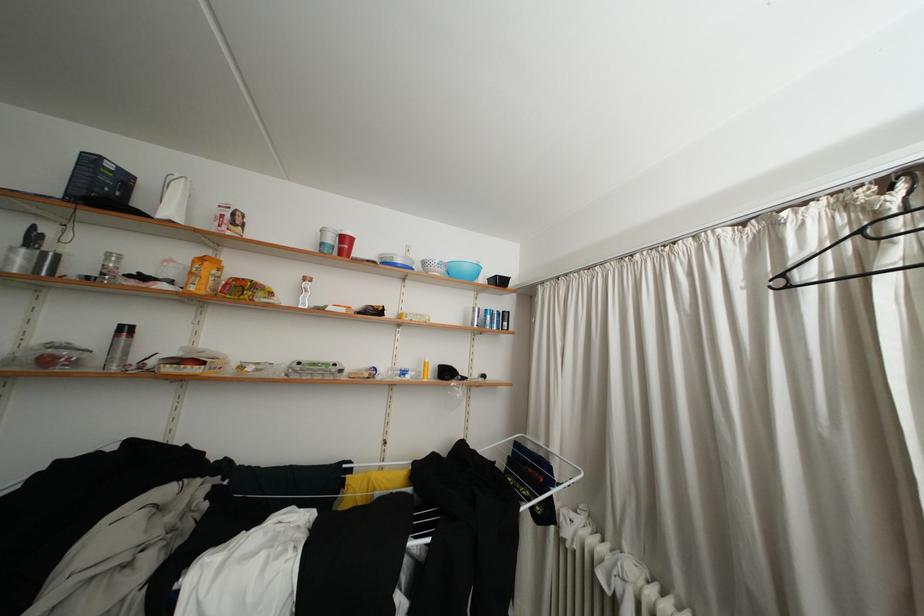
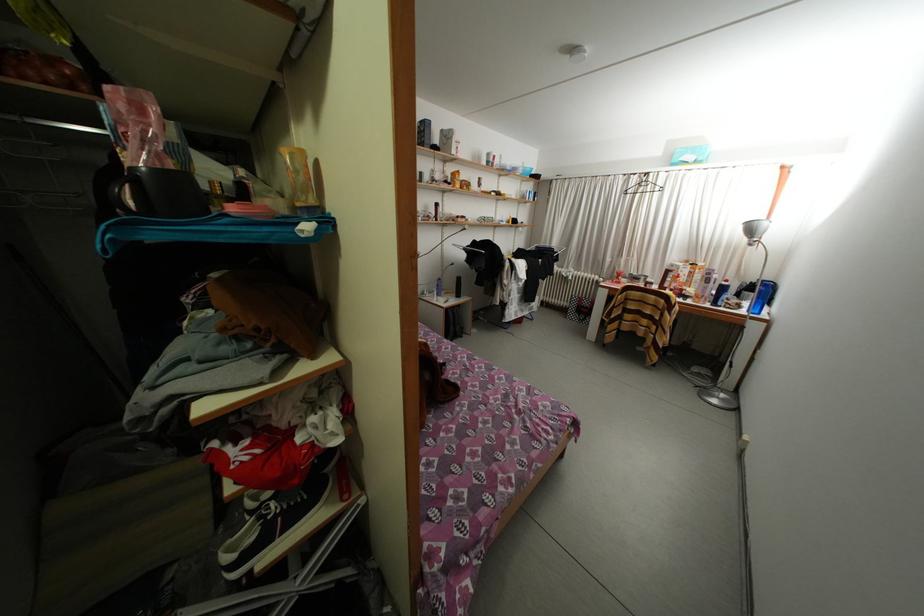
Find the pixel in the second image that matches the point at 783,231 in the first image.

(638, 184)